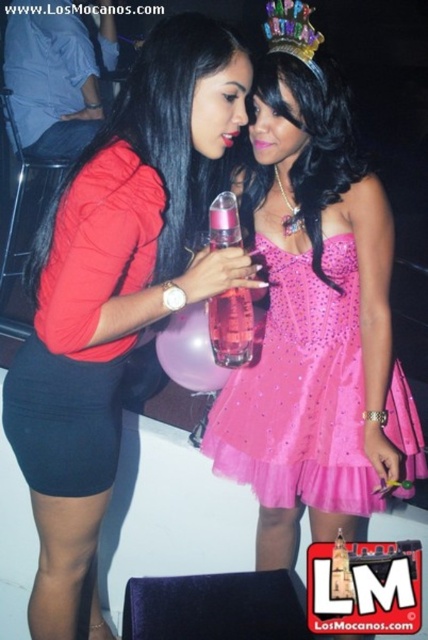
You are a photographer at a party and need to adjust the lighting between the matte black dress at center and the pink glass bottle at center. The minimum distance required for the lighting equipment to work properly is 30 centimeters. Based on the scene, can you use the equipment between them?

The distance between the matte black dress at center and the pink glass bottle at center is 26.49 centimeters, which is less than the required 30 centimeters. Therefore, the lighting equipment cannot be used between them.

You are a photographer trying to capture a closeup of the pink satin dress at center without including the pink tulle dress at center in the frame. Based on the scene description, is this possible?

The pink satin dress at center is located above the pink tulle dress at center, so it is possible to capture a closeup of the pink satin dress at center without including the pink tulle dress at center by focusing on the upper part of the scene where the pink satin dress at center is positioned.

You are organizing a costume party and need to decide which dress to wear. Both the pink satin dress at center and the pink tulle dress at center are available. Which dress has a larger size?

The pink satin dress at center is bigger than the pink tulle dress at center, so the pink satin dress at center has a larger size.